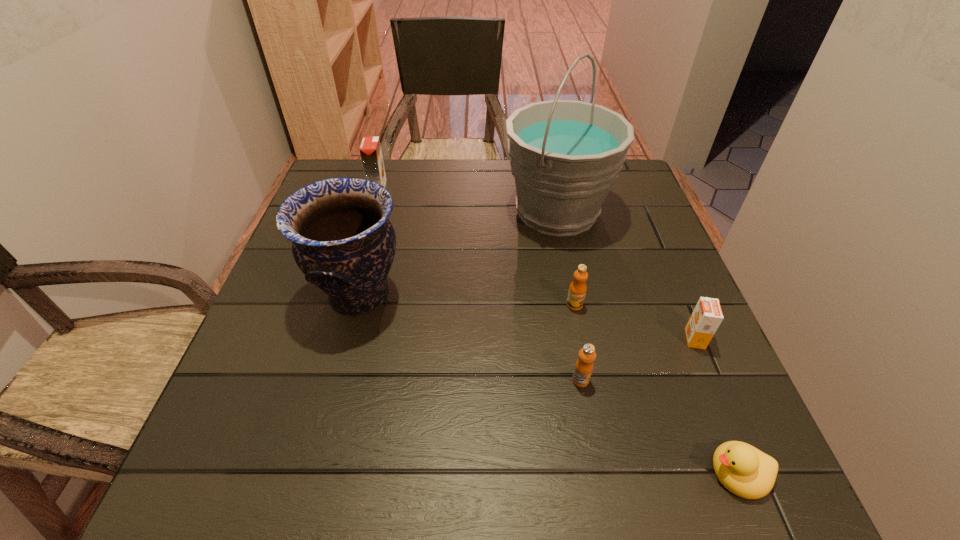
Locate an element on the screen. The image size is (960, 540). free spot at the near edge of the desktop is located at coordinates (515, 490).

Identify the location of vacant region at the left edge of the desktop. (298, 368).

Locate an element on the screen. The width and height of the screenshot is (960, 540). blank space at the right edge is located at coordinates (644, 309).

Image resolution: width=960 pixels, height=540 pixels. I want to click on vacant space at the near left corner, so click(x=262, y=469).

Where is `vacant area that lies between the nearest object and the bucket`? The height and width of the screenshot is (540, 960). vacant area that lies between the nearest object and the bucket is located at coordinates (648, 342).

This screenshot has height=540, width=960. In order to click on empty location between the second farthest orange juice and the pottery in this screenshot , I will do `click(467, 300)`.

Locate an element on the screen. vacant region between the rightmost orange juice and the third nearest orange juice is located at coordinates (635, 322).

The image size is (960, 540). I want to click on free space between the tallest orange juice and the second farthest orange juice, so click(x=476, y=246).

Locate an element on the screen. Image resolution: width=960 pixels, height=540 pixels. free point between the nearest object and the second farthest orange juice is located at coordinates (657, 389).

The image size is (960, 540). I want to click on vacant space that is in between the bucket and the second farthest orange juice, so click(x=566, y=258).